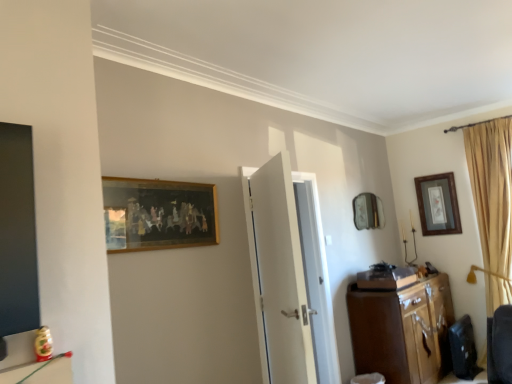
Locate an element on the screen. The image size is (512, 384). wooden cabinet at right is located at coordinates (403, 330).

Describe the element at coordinates (438, 204) in the screenshot. The image size is (512, 384). I see `wooden picture frame at upper right, which appears as the first picture frame when viewed from the right` at that location.

This screenshot has height=384, width=512. I want to click on white glossy door at center, so click(281, 274).

Considering the positions of objects wooden picture frame at upper right, which appears as the first picture frame when viewed from the right, and wooden framed artwork at upper left, the second picture frame when ordered from right to left, in the image provided, who is in front, wooden picture frame at upper right, which appears as the first picture frame when viewed from the right, or wooden framed artwork at upper left, the second picture frame when ordered from right to left,?

Positioned in front is wooden framed artwork at upper left, the second picture frame when ordered from right to left.

Considering the points (423, 185) and (174, 196), which point is behind, point (423, 185) or point (174, 196)?

The point (423, 185) is farther from the camera.

Find the location of a particular element. This screenshot has height=384, width=512. picture frame that appears above the wooden picture frame at upper right, the first picture frame positioned from the back (from the image's perspective) is located at coordinates (158, 214).

Considering the sizes of objects wooden picture frame at upper right, which is the second picture frame in left-to-right order, and wooden framed artwork at upper left, placed as the first picture frame when sorted from front to back, in the image provided, who is shorter, wooden picture frame at upper right, which is the second picture frame in left-to-right order, or wooden framed artwork at upper left, placed as the first picture frame when sorted from front to back,?

wooden framed artwork at upper left, placed as the first picture frame when sorted from front to back, is shorter.

Is wooden picture frame at upper right, marked as the second picture frame in a front-to-back arrangement, located within wooden cabinet at right?

Actually, wooden picture frame at upper right, marked as the second picture frame in a front-to-back arrangement, is outside wooden cabinet at right.

Considering the positions of points (414, 356) and (442, 189), is point (414, 356) closer to camera compared to point (442, 189)?

Yes, it is in front of point (442, 189).

Which object is positioned more to the right, wooden cabinet at right or wooden picture frame at upper right, the first picture frame positioned from the back?

wooden picture frame at upper right, the first picture frame positioned from the back.

Could you tell me if wooden cabinet at right is facing wooden picture frame at upper right, the first picture frame positioned from the back?

No.

From a real-world perspective, is white glossy door at center positioned above or below wooden framed artwork at upper left, which is the first picture frame from left to right?

In terms of real-world spatial position, white glossy door at center is below wooden framed artwork at upper left, which is the first picture frame from left to right.

Can you tell me how much white glossy door at center and wooden framed artwork at upper left, which is the first picture frame from left to right, differ in facing direction?

There is a 52.8-degree angle between the facing directions of white glossy door at center and wooden framed artwork at upper left, which is the first picture frame from left to right.

Is white glossy door at center to the left of wooden framed artwork at upper left, which is the first picture frame from left to right, from the viewer's perspective?

Incorrect, white glossy door at center is not on the left side of wooden framed artwork at upper left, which is the first picture frame from left to right.

Between point (286, 198) and point (160, 183), which one is positioned behind?

The point (160, 183) is farther.

Can you confirm if white glossy door at center is shorter than wooden cabinet at right?

In fact, white glossy door at center may be taller than wooden cabinet at right.

Where is `door above the wooden cabinet at right (from a real-world perspective)`? The height and width of the screenshot is (384, 512). door above the wooden cabinet at right (from a real-world perspective) is located at coordinates (281, 274).

Looking at this image, from the image's perspective, which one is positioned higher, white glossy door at center or wooden cabinet at right?

white glossy door at center, from the image's perspective.

Is wooden framed artwork at upper left, which is the first picture frame from left to right, turned away from wooden cabinet at right?

No, wooden framed artwork at upper left, which is the first picture frame from left to right,'s orientation is not away from wooden cabinet at right.

From a real-world perspective, which object stands above the other?

wooden framed artwork at upper left, the second picture frame when ordered from right to left, from a real-world perspective.

Can you confirm if wooden framed artwork at upper left, placed as the 2th picture frame when sorted from back to front, is thinner than wooden cabinet at right?

Correct, the width of wooden framed artwork at upper left, placed as the 2th picture frame when sorted from back to front, is less than that of wooden cabinet at right.

Where is `cabinetry behind the wooden framed artwork at upper left, placed as the first picture frame when sorted from front to back`? The height and width of the screenshot is (384, 512). cabinetry behind the wooden framed artwork at upper left, placed as the first picture frame when sorted from front to back is located at coordinates (403, 330).

In the scene shown: Can you confirm if wooden framed artwork at upper left, the second picture frame when ordered from right to left, is taller than wooden picture frame at upper right, which is the second picture frame in left-to-right order?

No, wooden framed artwork at upper left, the second picture frame when ordered from right to left, is not taller than wooden picture frame at upper right, which is the second picture frame in left-to-right order.

From a real-world perspective, between wooden framed artwork at upper left, the second picture frame when ordered from right to left, and wooden picture frame at upper right, which is the second picture frame in left-to-right order, who is vertically lower?

From a 3D spatial view, wooden picture frame at upper right, which is the second picture frame in left-to-right order, is below.

Is wooden framed artwork at upper left, placed as the first picture frame when sorted from front to back, to the left or to the right of wooden picture frame at upper right, which appears as the first picture frame when viewed from the right, in the image?

Based on their positions, wooden framed artwork at upper left, placed as the first picture frame when sorted from front to back, is located to the left of wooden picture frame at upper right, which appears as the first picture frame when viewed from the right.

Is wooden framed artwork at upper left, placed as the 2th picture frame when sorted from back to front, far away from wooden picture frame at upper right, which is the second picture frame in left-to-right order?

Absolutely, wooden framed artwork at upper left, placed as the 2th picture frame when sorted from back to front, is distant from wooden picture frame at upper right, which is the second picture frame in left-to-right order.

From a real-world perspective, who is located higher, wooden framed artwork at upper left, placed as the first picture frame when sorted from front to back, or white glossy door at center?

wooden framed artwork at upper left, placed as the first picture frame when sorted from front to back, from a real-world perspective.

Considering the relative sizes of wooden framed artwork at upper left, which is the first picture frame from left to right, and white glossy door at center in the image provided, is wooden framed artwork at upper left, which is the first picture frame from left to right, smaller than white glossy door at center?

Yes.

Is wooden framed artwork at upper left, which is the first picture frame from left to right, facing towards white glossy door at center?

No, wooden framed artwork at upper left, which is the first picture frame from left to right, is not facing towards white glossy door at center.

Consider the image. Considering the sizes of objects wooden framed artwork at upper left, placed as the first picture frame when sorted from front to back, and white glossy door at center in the image provided, who is taller, wooden framed artwork at upper left, placed as the first picture frame when sorted from front to back, or white glossy door at center?

With more height is white glossy door at center.

Identify the location of picture frame below the wooden framed artwork at upper left, placed as the 2th picture frame when sorted from back to front (from the image's perspective). The width and height of the screenshot is (512, 384). (438, 204).

Where is `the 1st picture frame above when counting from the wooden cabinet at right (from the image's perspective)`? The height and width of the screenshot is (384, 512). the 1st picture frame above when counting from the wooden cabinet at right (from the image's perspective) is located at coordinates (438, 204).

From the image, which object appears to be farther from white glossy door at center, wooden cabinet at right or wooden framed artwork at upper left, placed as the 2th picture frame when sorted from back to front?

wooden cabinet at right is positioned further to the anchor white glossy door at center.

Looking at the image, which one is located closer to wooden framed artwork at upper left, placed as the first picture frame when sorted from front to back, wooden cabinet at right or wooden picture frame at upper right, which appears as the first picture frame when viewed from the right?

Based on the image, wooden cabinet at right appears to be nearer to wooden framed artwork at upper left, placed as the first picture frame when sorted from front to back.

Considering their positions, is wooden framed artwork at upper left, which is the first picture frame from left to right, positioned closer to wooden picture frame at upper right, which is the second picture frame in left-to-right order, than wooden cabinet at right?

wooden cabinet at right is closer to wooden picture frame at upper right, which is the second picture frame in left-to-right order.

When comparing their distances from wooden picture frame at upper right, the first picture frame positioned from the back, does wooden cabinet at right or wooden framed artwork at upper left, placed as the 2th picture frame when sorted from back to front, seem closer?

wooden cabinet at right is positioned closer to the anchor wooden picture frame at upper right, the first picture frame positioned from the back.

Based on their spatial positions, is wooden framed artwork at upper left, the second picture frame when ordered from right to left, or wooden picture frame at upper right, which appears as the first picture frame when viewed from the right, further from wooden cabinet at right?

The object further to wooden cabinet at right is wooden framed artwork at upper left, the second picture frame when ordered from right to left.

Which object lies nearer to the anchor point wooden cabinet at right, white glossy door at center or wooden framed artwork at upper left, placed as the 2th picture frame when sorted from back to front?

Based on the image, white glossy door at center appears to be nearer to wooden cabinet at right.

Consider the image. When comparing their distances from white glossy door at center, does wooden framed artwork at upper left, the second picture frame when ordered from right to left, or wooden cabinet at right seem closer?

wooden framed artwork at upper left, the second picture frame when ordered from right to left.

When comparing their distances from wooden picture frame at upper right, the first picture frame positioned from the back, does white glossy door at center or wooden framed artwork at upper left, placed as the first picture frame when sorted from front to back, seem closer?

white glossy door at center is positioned closer to the anchor wooden picture frame at upper right, the first picture frame positioned from the back.

At what (x,y) coordinates should I click in order to perform the action: click on picture frame located between white glossy door at center and wooden picture frame at upper right, the first picture frame positioned from the back, in the depth direction. Please return your answer as a coordinate pair (x, y). The image size is (512, 384). Looking at the image, I should click on (158, 214).

I want to click on door between wooden framed artwork at upper left, placed as the first picture frame when sorted from front to back, and wooden cabinet at right, so click(281, 274).

Where is `cabinetry located between wooden framed artwork at upper left, which is the first picture frame from left to right, and wooden picture frame at upper right, which is the second picture frame in left-to-right order, in the left-right direction`? cabinetry located between wooden framed artwork at upper left, which is the first picture frame from left to right, and wooden picture frame at upper right, which is the second picture frame in left-to-right order, in the left-right direction is located at coordinates (403, 330).

The width and height of the screenshot is (512, 384). What are the coordinates of `cabinetry located between white glossy door at center and wooden picture frame at upper right, which appears as the first picture frame when viewed from the right, in the depth direction` in the screenshot? It's located at (403, 330).